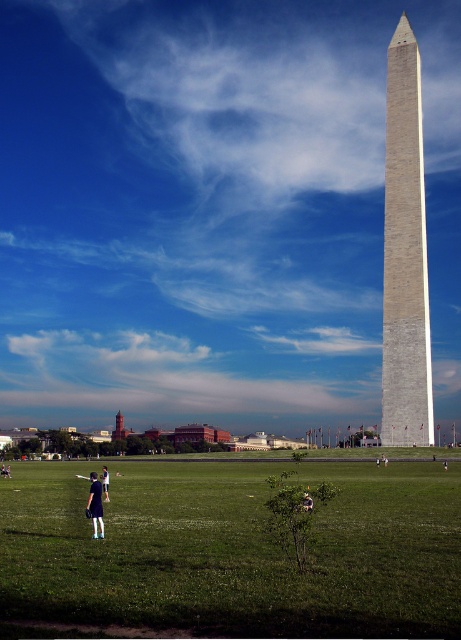
What do you see at coordinates (405, 253) in the screenshot? I see `gray stone obelisk at center` at bounding box center [405, 253].

Who is shorter, gray stone obelisk at center or blue denim jeans at lower left?

With less height is blue denim jeans at lower left.

Which is in front, point (399, 332) or point (106, 476)?

Point (106, 476) is in front.

Identify the location of gray stone obelisk at center. Image resolution: width=461 pixels, height=640 pixels. (405, 253).

Which is more to the left, gray stone obelisk at center or denim jacket at lower right?

From the viewer's perspective, denim jacket at lower right appears more on the left side.

Who is shorter, gray stone obelisk at center or denim jacket at lower right?

Standing shorter between the two is denim jacket at lower right.

Does point (401, 92) come farther from viewer compared to point (308, 509)?

Yes, point (401, 92) is farther from viewer.

Find the location of a particular element. This screenshot has height=640, width=461. gray stone obelisk at center is located at coordinates (405, 253).

Is dark blue dress at lower left shorter than denim jacket at lower right?

In fact, dark blue dress at lower left may be taller than denim jacket at lower right.

Is dark blue dress at lower left taller than denim jacket at lower right?

Indeed, dark blue dress at lower left has a greater height compared to denim jacket at lower right.

Does point (99, 506) lie in front of point (309, 509)?

No, (99, 506) is further to viewer.

At what (x,y) coordinates should I click in order to perform the action: click on dark blue dress at lower left. Please return your answer as a coordinate pair (x, y). The width and height of the screenshot is (461, 640). Looking at the image, I should click on tap(95, 506).